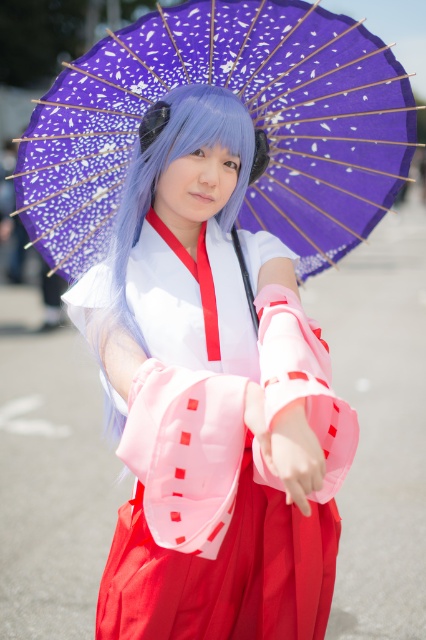
Is matte pink kimono at center closer to camera compared to purple paper umbrella at upper center?

Yes, it is.

Is matte pink kimono at center to the right of purple paper umbrella at upper center from the viewer's perspective?

Correct, you'll find matte pink kimono at center to the right of purple paper umbrella at upper center.

Is point (196, 244) positioned behind point (365, 97)?

No, it is not.

Image resolution: width=426 pixels, height=640 pixels. In order to click on matte pink kimono at center in this screenshot , I will do `click(212, 401)`.